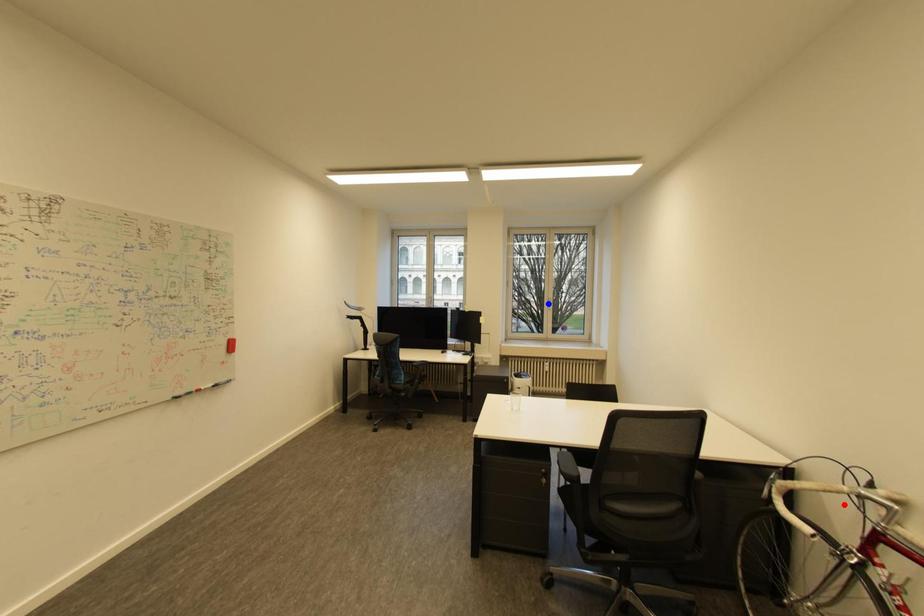
Question: In the image, two points are highlighted. Which point is nearer to the camera? Reply with the corresponding letter.

Choices:
 (A) blue point
 (B) red point

Answer: (B)